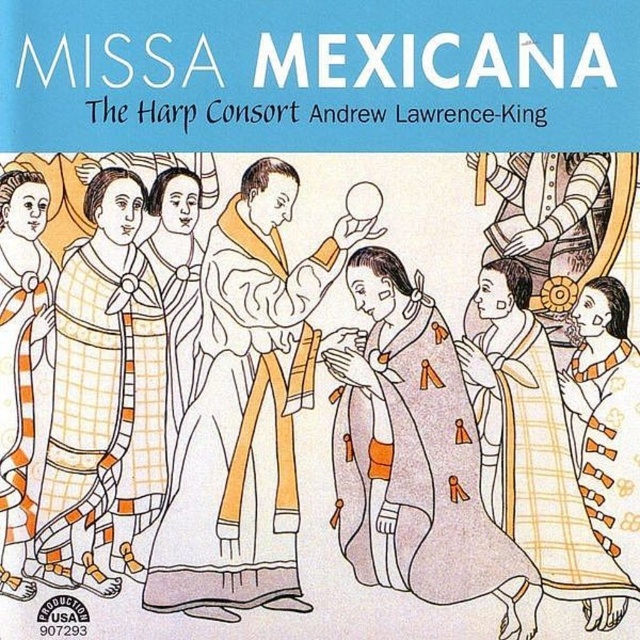
You are an observer looking at the album cover for Missa Mexicana. You notice two orange robes. The first is an orange plaid robe at center, and the second is an orange striped robe at left. Which robe takes up more space in the image?

The orange plaid robe at center is bigger than the orange striped robe at left, so it takes up more space in the image.

Looking at the album cover for Missa Mexicana by The Harp Consort, there is a point marked at coordinates [413,456]. What object is located at this point?

The point at coordinates [413,456] marks the orange plaid robe at center.

Based on the scene described, if you were to draw a straight line from the point at (388, 388) to the point at (124, 195), would the line pass through any other objects mentioned in the scene?

The point at (388, 388) is behind the point at (124, 195), so a straight line between them would not pass through any other objects mentioned in the scene.